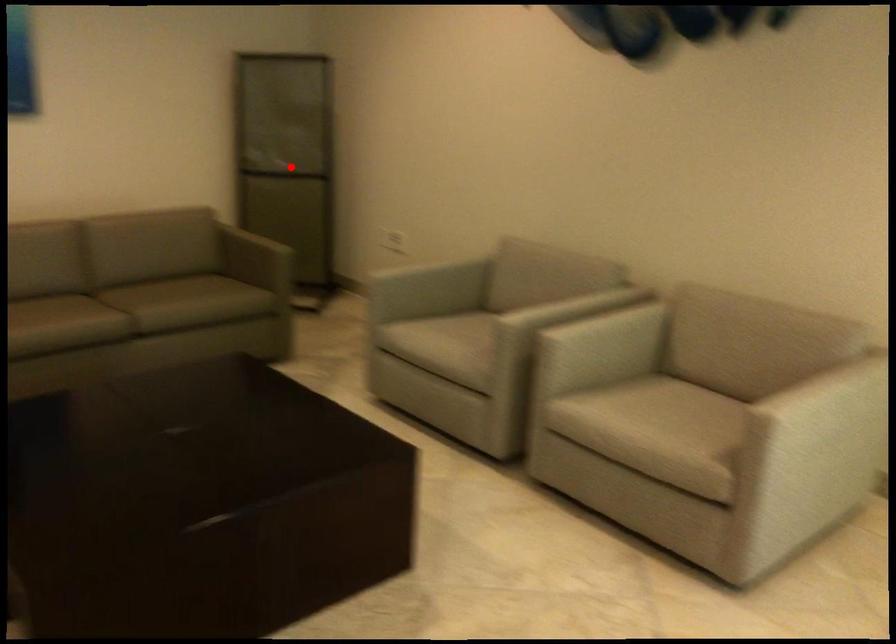
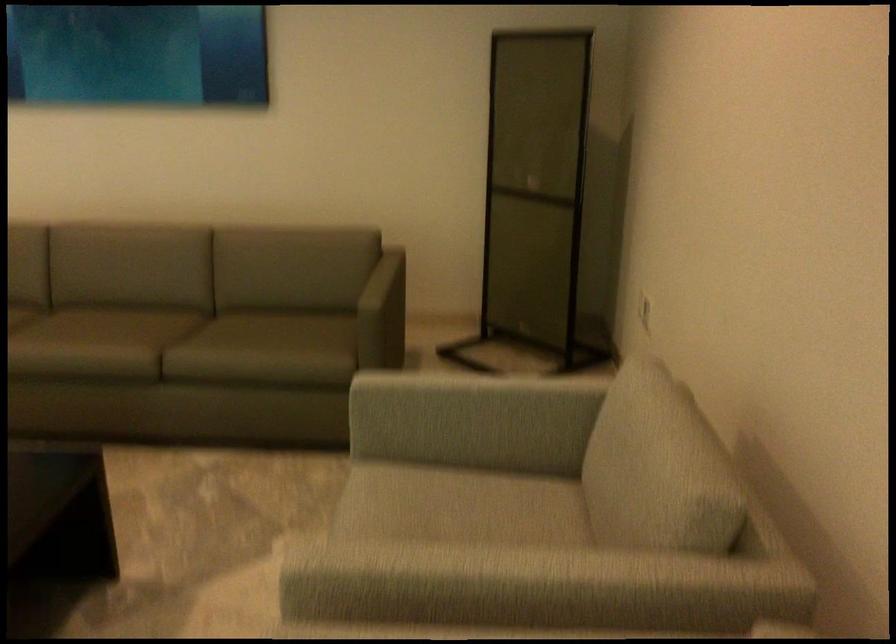
Question: I am providing you with two images of the same scene from different viewpoints. A red point is shown in image1. For the corresponding object point in image2, is it positioned nearer or farther from the camera?

Choices:
 (A) Nearer
 (B) Farther

Answer: (A)